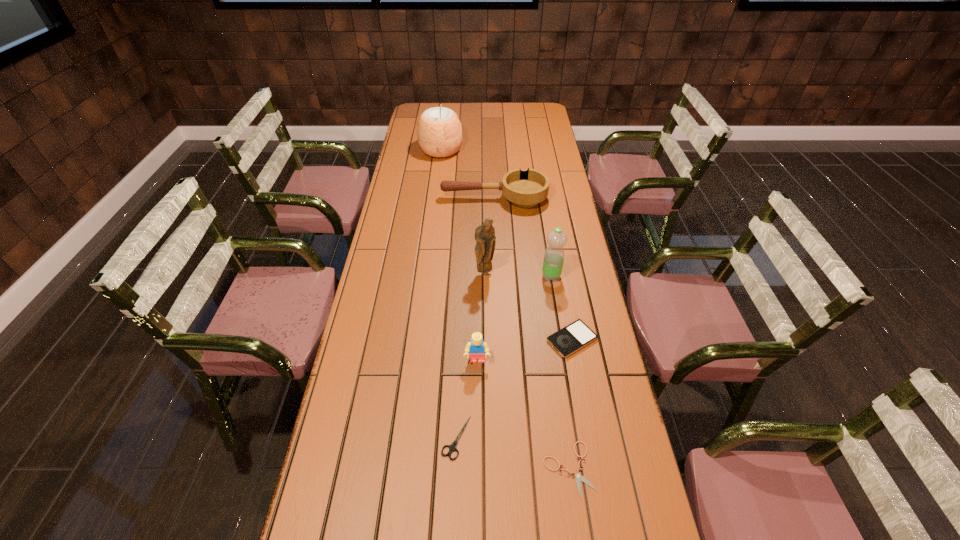
Locate which object ranks second in proximity to the right shears. Please provide its 2D coordinates. Your answer should be formatted as a tuple, i.e. [(x, y)], where the tuple contains the x and y coordinates of a point satisfying the conditions above.

[(573, 337)]